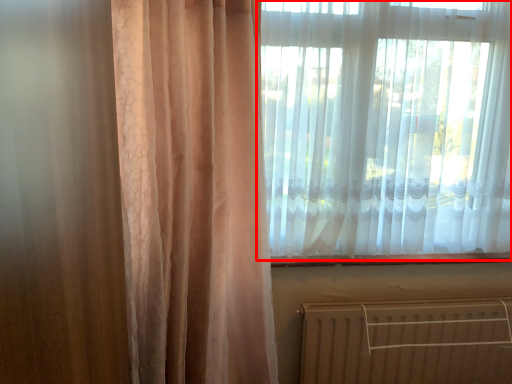
Question: In this image, where is curtain (annotated by the red box) located relative to radiator?

Choices:
 (A) right
 (B) left

Answer: (B)